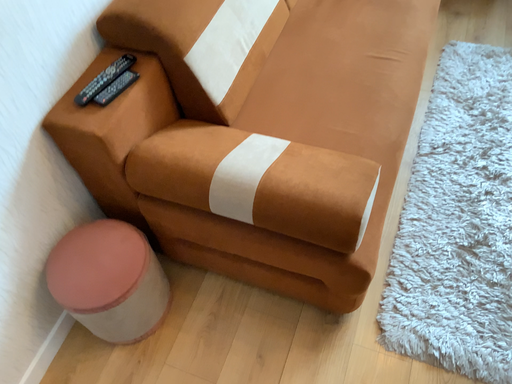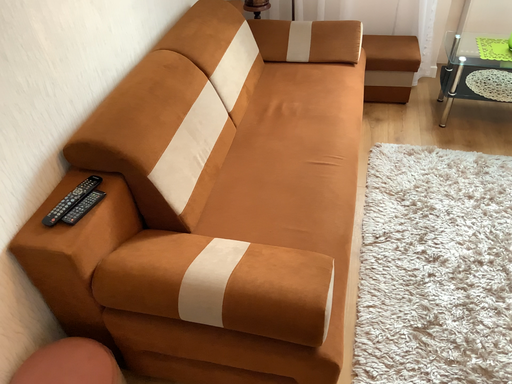
Question: How did the camera likely rotate when shooting the video?

Choices:
 (A) rotated right
 (B) rotated left

Answer: (A)